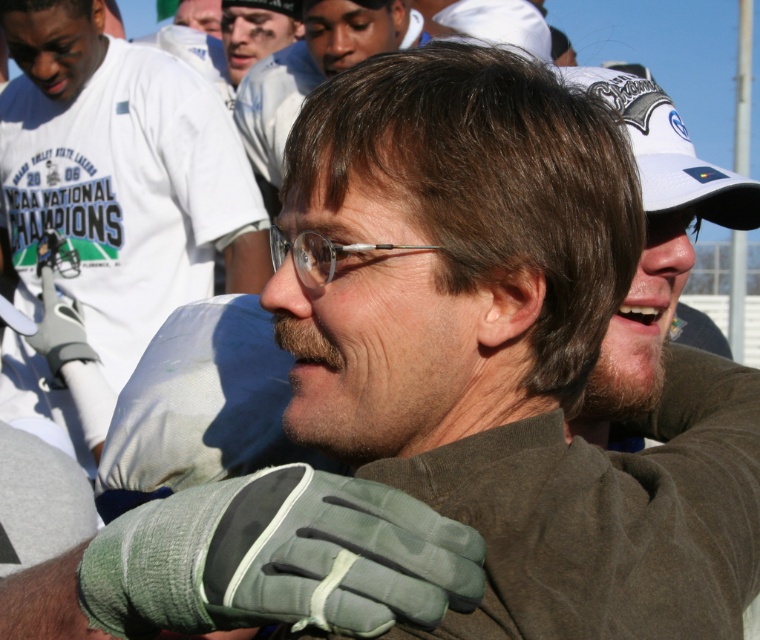
Based on the photo, can you confirm if brown matte hair at upper center is thinner than clear plastic glasses at center?

Incorrect, brown matte hair at upper center's width is not less than clear plastic glasses at center's.

Can you confirm if brown matte hair at upper center is positioned to the left of clear plastic glasses at center?

Correct, you'll find brown matte hair at upper center to the left of clear plastic glasses at center.

What do you see at coordinates (309, 74) in the screenshot?
I see `brown matte hair at upper center` at bounding box center [309, 74].

This screenshot has height=640, width=760. In order to click on brown matte hair at upper center in this screenshot , I will do `click(309, 74)`.

Does brown matte hair at upper center appear under white fabric baseball cap at upper right?

No.

Is point (249, 74) positioned after point (580, 68)?

Yes, it is.

Locate an element on the screen. This screenshot has height=640, width=760. brown matte hair at upper center is located at coordinates (309, 74).

Where is `green fabric glove at center`? green fabric glove at center is located at coordinates (122, 173).

In order to click on green fabric glove at center in this screenshot , I will do `click(122, 173)`.

Find the location of a particular element. The width and height of the screenshot is (760, 640). green fabric glove at center is located at coordinates (122, 173).